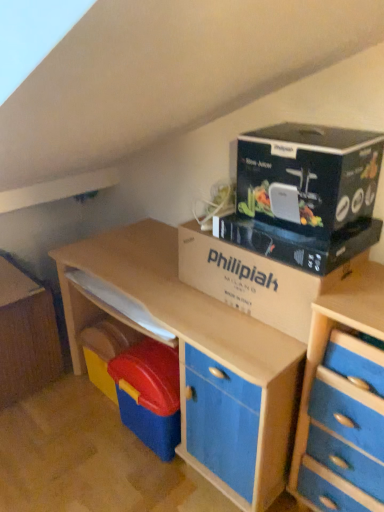
Identify the location of blue wood chest of drawers at right. The height and width of the screenshot is (512, 384). (343, 401).

Measure the distance between cardboard box at center and camera.

cardboard box at center and camera are 3.95 feet apart from each other.

Identify the location of cardboard box at center. The height and width of the screenshot is (512, 384). (258, 278).

The image size is (384, 512). I want to click on blue matte file cabinet at lower left, so click(26, 336).

You are a GUI agent. You are given a task and a screenshot of the screen. Output one action in this format:
    pyautogui.click(x=<x>, y=<y>)
    Task: Click on the blue wood chest of drawers at right
    The width and height of the screenshot is (384, 512).
    Given the screenshot: What is the action you would take?
    (x=343, y=401)

Considering the sizes of cardboard box at center and blue wood chest of drawers at right in the image, is cardboard box at center bigger or smaller than blue wood chest of drawers at right?

Clearly, cardboard box at center is smaller in size than blue wood chest of drawers at right.

Can you confirm if cardboard box at center is wider than blue wood chest of drawers at right?

Incorrect, the width of cardboard box at center does not surpass that of blue wood chest of drawers at right.

From the image's perspective, would you say cardboard box at center is positioned over blue wood chest of drawers at right?

Yes.

Considering the positions of objects cardboard box at center and blue wood chest of drawers at right in the image provided, who is more to the right, cardboard box at center or blue wood chest of drawers at right?

From the viewer's perspective, blue wood chest of drawers at right appears more on the right side.

Is blue wood chest of drawers at right next to cardboard box at center and touching it?

No, blue wood chest of drawers at right is not beside cardboard box at center.

Find the location of `cardboard box lying on the left of blue wood chest of drawers at right`. cardboard box lying on the left of blue wood chest of drawers at right is located at coordinates (258, 278).

In the scene shown: From a real-world perspective, who is located higher, blue wood chest of drawers at right or cardboard box at center?

cardboard box at center is physically above.

How much distance is there between black cardboard at upper right and cardboard box at center?

black cardboard at upper right and cardboard box at center are 8.53 inches apart from each other.

Based on the photo, is black cardboard at upper right facing away from cardboard box at center?

No.

Which of these two, black cardboard at upper right or cardboard box at center, is thinner?

cardboard box at center.

The width and height of the screenshot is (384, 512). Find the location of `cardboard box lying on the left of black cardboard at upper right`. cardboard box lying on the left of black cardboard at upper right is located at coordinates (258, 278).

Is cardboard box at center facing towards blue matte file cabinet at lower left?

No, cardboard box at center is not facing towards blue matte file cabinet at lower left.

Is cardboard box at center inside the boundaries of blue matte file cabinet at lower left, or outside?

cardboard box at center is not enclosed by blue matte file cabinet at lower left.

Considering the relative sizes of cardboard box at center and blue matte file cabinet at lower left in the image provided, is cardboard box at center thinner than blue matte file cabinet at lower left?

Correct, the width of cardboard box at center is less than that of blue matte file cabinet at lower left.

Can you confirm if cardboard box at center is smaller than blue matte file cabinet at lower left?

Indeed, cardboard box at center has a smaller size compared to blue matte file cabinet at lower left.

Is point (339, 159) positioned in front of point (25, 310)?

Yes.

Who is bigger, black cardboard at upper right or blue matte file cabinet at lower left?

blue matte file cabinet at lower left.

Which of these two, black cardboard at upper right or blue matte file cabinet at lower left, stands shorter?

black cardboard at upper right is shorter.

Are black cardboard at upper right and blue matte file cabinet at lower left located far from each other?

Yes.

Is blue wood chest of drawers at right a part of black cardboard at upper right?

Actually, blue wood chest of drawers at right is outside black cardboard at upper right.

Is black cardboard at upper right smaller than blue wood chest of drawers at right?

Correct, black cardboard at upper right occupies less space than blue wood chest of drawers at right.

Who is more distant, black cardboard at upper right or blue wood chest of drawers at right?

black cardboard at upper right is behind.

Is black cardboard at upper right taller or shorter than blue wood chest of drawers at right?

Considering their sizes, black cardboard at upper right has less height than blue wood chest of drawers at right.

Does blue wood chest of drawers at right have a smaller size compared to black cardboard at upper right?

Incorrect, blue wood chest of drawers at right is not smaller in size than black cardboard at upper right.

Would you say black cardboard at upper right is part of blue wood chest of drawers at right's contents?

No, black cardboard at upper right is not a part of blue wood chest of drawers at right.

What are the coordinates of `the chest of drawers below the black cardboard at upper right (from a real-world perspective)` in the screenshot? It's located at pos(343,401).

Is blue wood chest of drawers at right next to black cardboard at upper right?

blue wood chest of drawers at right and black cardboard at upper right are clearly separated.

Identify the location of chest of drawers below the cardboard box at center (from the image's perspective). (343, 401).

Where is `cardboard box on the left of blue wood chest of drawers at right`? Image resolution: width=384 pixels, height=512 pixels. cardboard box on the left of blue wood chest of drawers at right is located at coordinates (258, 278).

Estimate the real-world distances between objects in this image. Which object is closer to cardboard box at center, blue matte file cabinet at lower left or blue wood chest of drawers at right?

blue wood chest of drawers at right lies closer to cardboard box at center than the other object.

Looking at the image, which one is located closer to cardboard box at center, blue wood chest of drawers at right or blue matte file cabinet at lower left?

Based on the image, blue wood chest of drawers at right appears to be nearer to cardboard box at center.

Consider the image. Considering their positions, is blue matte file cabinet at lower left positioned closer to black cardboard at upper right than cardboard box at center?

cardboard box at center lies closer to black cardboard at upper right than the other object.

Based on the photo, from the image, which object appears to be farther from cardboard box at center, black cardboard at upper right or blue matte file cabinet at lower left?

Based on the image, blue matte file cabinet at lower left appears to be further to cardboard box at center.

Considering their positions, is blue wood chest of drawers at right positioned further to cardboard box at center than black cardboard at upper right?

Based on the image, blue wood chest of drawers at right appears to be further to cardboard box at center.

From the image, which object appears to be farther from blue matte file cabinet at lower left, cardboard box at center or blue wood chest of drawers at right?

Among the two, blue wood chest of drawers at right is located further to blue matte file cabinet at lower left.

Looking at the image, which one is located closer to black cardboard at upper right, cardboard box at center or blue matte file cabinet at lower left?

cardboard box at center is positioned closer to the anchor black cardboard at upper right.

Which object lies nearer to the anchor point blue matte file cabinet at lower left, black cardboard at upper right or blue wood chest of drawers at right?

black cardboard at upper right is positioned closer to the anchor blue matte file cabinet at lower left.

Identify the location of cardboard box between blue matte file cabinet at lower left and blue wood chest of drawers at right from left to right. (258, 278).

Find the location of `cardboard between blue matte file cabinet at lower left and blue wood chest of drawers at right in the horizontal direction`. cardboard between blue matte file cabinet at lower left and blue wood chest of drawers at right in the horizontal direction is located at coordinates (308, 176).

This screenshot has width=384, height=512. I want to click on cardboard box between black cardboard at upper right and blue wood chest of drawers at right vertically, so click(x=258, y=278).

This screenshot has height=512, width=384. Find the location of `cardboard box situated between blue matte file cabinet at lower left and black cardboard at upper right from left to right`. cardboard box situated between blue matte file cabinet at lower left and black cardboard at upper right from left to right is located at coordinates (258, 278).